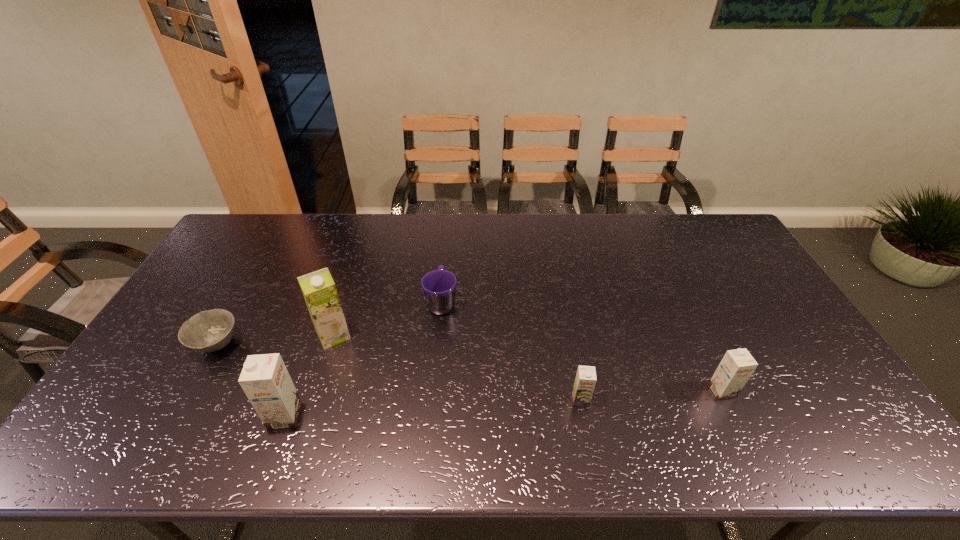
Please point a location where one more chocolate_milk can be added evenly. Please provide its 2D coordinates. Your answer should be formatted as a tuple, i.e. [(x, y)], where the tuple contains the x and y coordinates of a point satisfying the conditions above.

[(435, 408)]